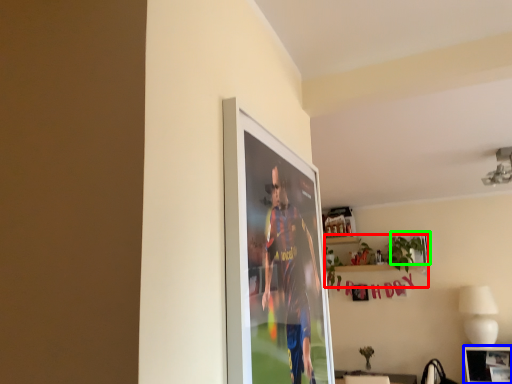
Question: Considering the real-world distances, which object is farthest from houseplant (highlighted by a red box)? picture frame (highlighted by a blue box) or picture frame (highlighted by a green box)?

Choices:
 (A) picture frame
 (B) picture frame

Answer: (A)